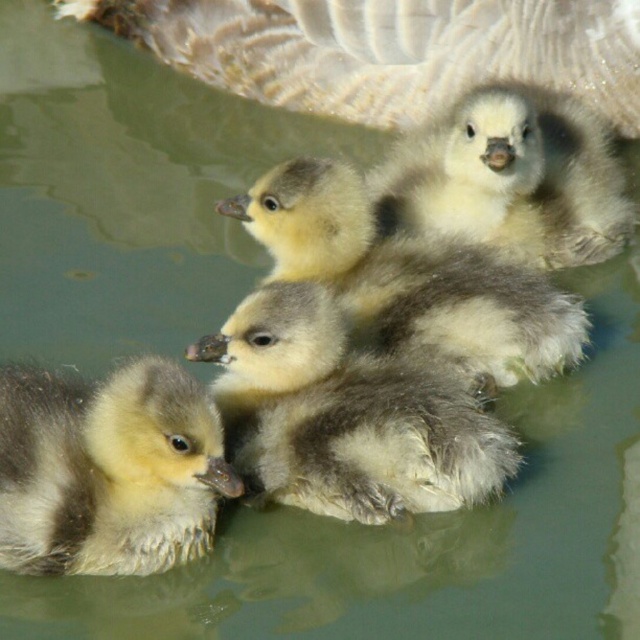
Question: Is gray downy feathers at upper center to the left of soft yellow downy duckling at upper center from the viewer's perspective?

Choices:
 (A) no
 (B) yes

Answer: (B)

Question: Does gray downy feathers at upper center have a greater width compared to soft gray downy duckling at lower left?

Choices:
 (A) no
 (B) yes

Answer: (B)

Question: Which point appears closest to the camera in this image?

Choices:
 (A) (621, 204)
 (B) (288, 204)
 (C) (157, 468)
 (D) (464, 80)

Answer: (C)

Question: Which object is positioned closest to the soft gray downy duckling at lower left?

Choices:
 (A) soft gray downy duckling at center
 (B) gray downy feathers at upper center
 (C) soft yellow duckling at center

Answer: (A)

Question: Considering the relative positions of gray downy feathers at upper center and soft yellow duckling at center in the image provided, where is gray downy feathers at upper center located with respect to soft yellow duckling at center?

Choices:
 (A) above
 (B) below

Answer: (A)

Question: Which point is closer to the camera?

Choices:
 (A) (380, 429)
 (B) (150, 534)

Answer: (B)